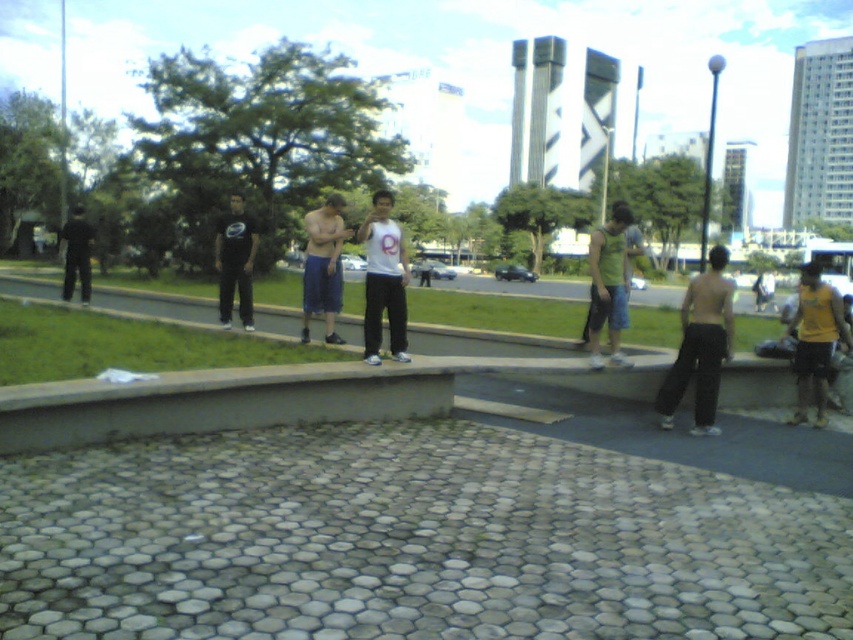
Does point (338, 292) lie behind point (250, 292)?

No, (338, 292) is closer to viewer.

Can you confirm if blue denim shorts at center is positioned to the left of black matte pants at center?

In fact, blue denim shorts at center is to the right of black matte pants at center.

You are a GUI agent. You are given a task and a screenshot of the screen. Output one action in this format:
    pyautogui.click(x=<x>, y=<y>)
    Task: Click on the blue denim shorts at center
    
    Given the screenshot: What is the action you would take?
    pyautogui.click(x=323, y=266)

Can you confirm if black cotton pants at center is positioned below blue denim shorts at center?

Correct, black cotton pants at center is located below blue denim shorts at center.

Which is more to the right, black cotton pants at center or blue denim shorts at center?

Positioned to the right is black cotton pants at center.

The height and width of the screenshot is (640, 853). I want to click on black cotton pants at center, so click(x=700, y=346).

The image size is (853, 640). I want to click on black cotton pants at center, so click(700, 346).

Is point (367, 324) behind point (74, 236)?

No, it is in front of (74, 236).

Who is shorter, white matte tank top at center or dark gray pants at left?

With less height is white matte tank top at center.

Is point (370, 348) positioned after point (86, 266)?

No, (370, 348) is closer to viewer.

This screenshot has height=640, width=853. In order to click on white matte tank top at center in this screenshot , I will do `click(383, 280)`.